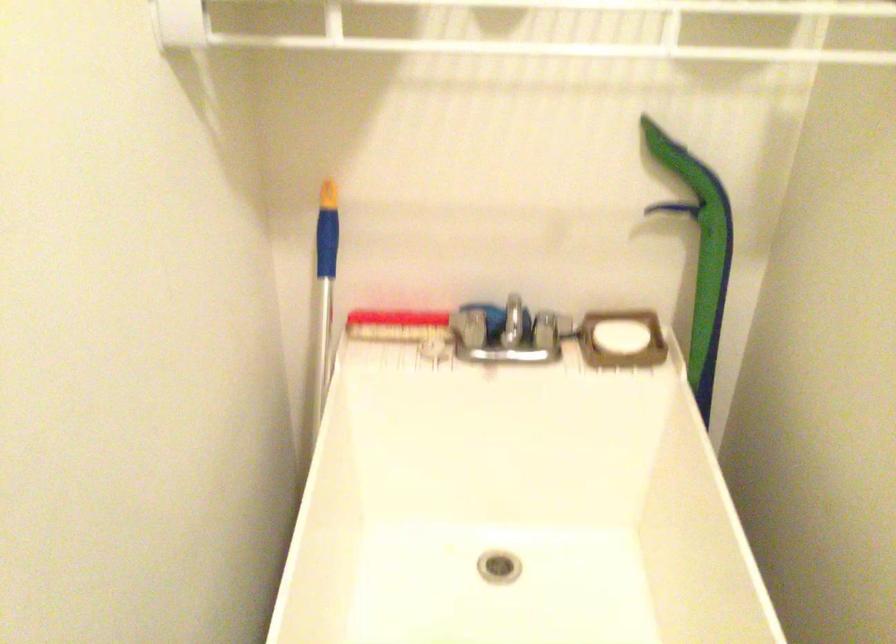
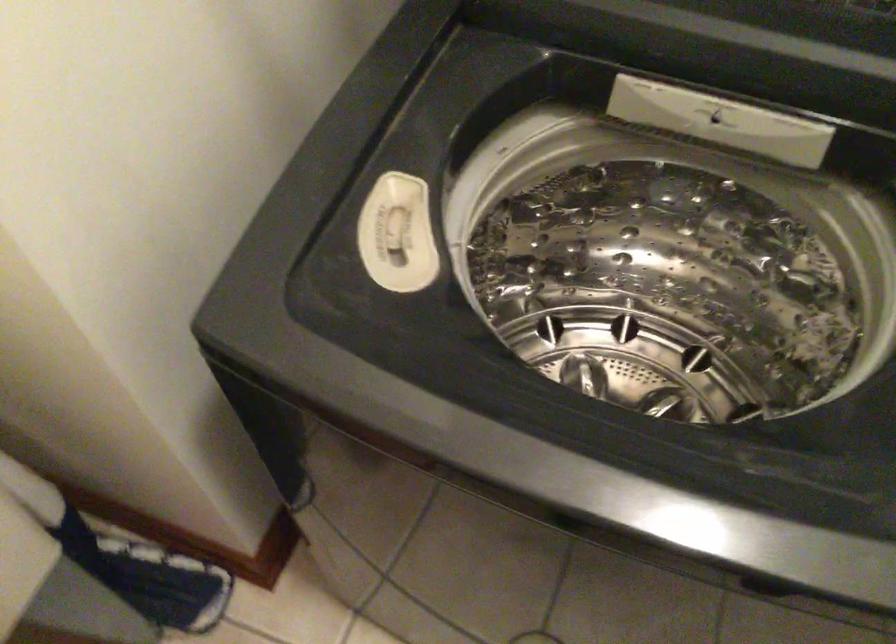
The first image is from the beginning of the video and the second image is from the end. How did the camera likely rotate when shooting the video?

The camera rotated toward right-down.